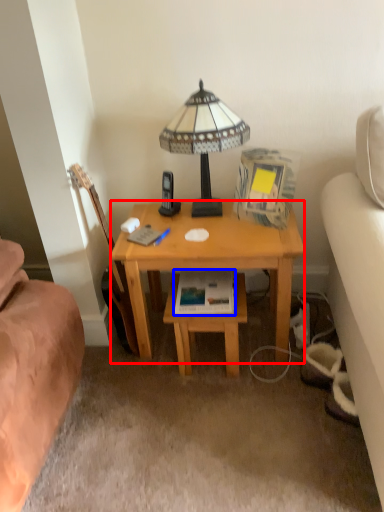
Question: Which object is further to the camera taking this photo, desk (highlighted by a red box) or paperback book (highlighted by a blue box)?

Choices:
 (A) desk
 (B) paperback book

Answer: (B)